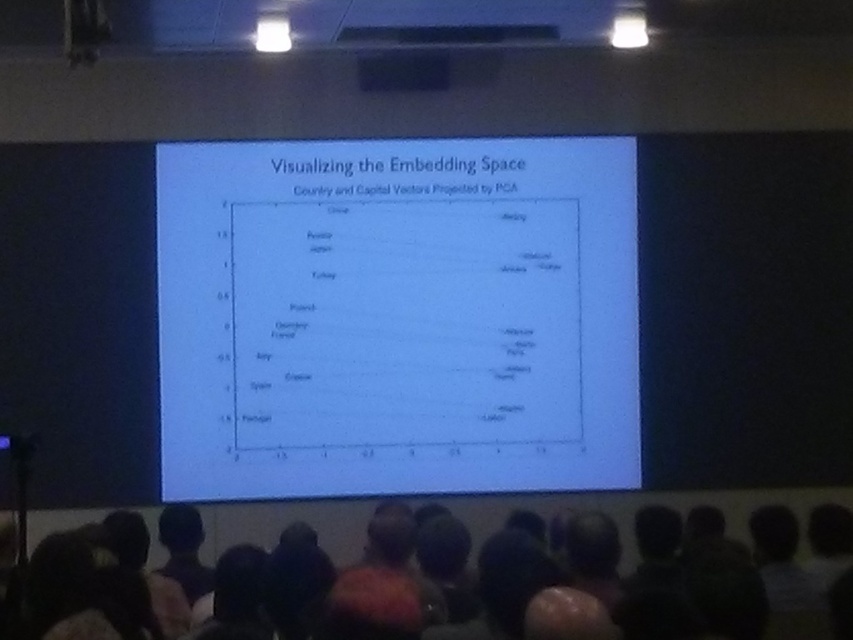
Question: Does dark hair at lower center lie in front of black matte rectangle at upper center?

Choices:
 (A) no
 (B) yes

Answer: (B)

Question: Among these objects, which one is nearest to the camera?

Choices:
 (A) dark hair at lower center
 (B) white paper at center

Answer: (A)

Question: Is white paper at center wider than dark hair at lower center?

Choices:
 (A) yes
 (B) no

Answer: (A)

Question: Which point is farther to the camera?

Choices:
 (A) black matte rectangle at upper center
 (B) dark hair at lower center
 (C) white paper at center

Answer: (A)

Question: Which point is farther to the camera?

Choices:
 (A) white paper at center
 (B) black matte rectangle at upper center

Answer: (B)

Question: Does dark hair at lower center have a smaller size compared to black matte rectangle at upper center?

Choices:
 (A) yes
 (B) no

Answer: (B)